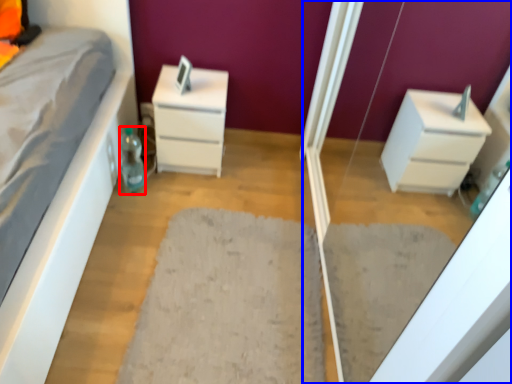
Question: Which of the following is the closest to the observer, bottle (highlighted by a red box) or screen door (highlighted by a blue box)?

Choices:
 (A) bottle
 (B) screen door

Answer: (B)